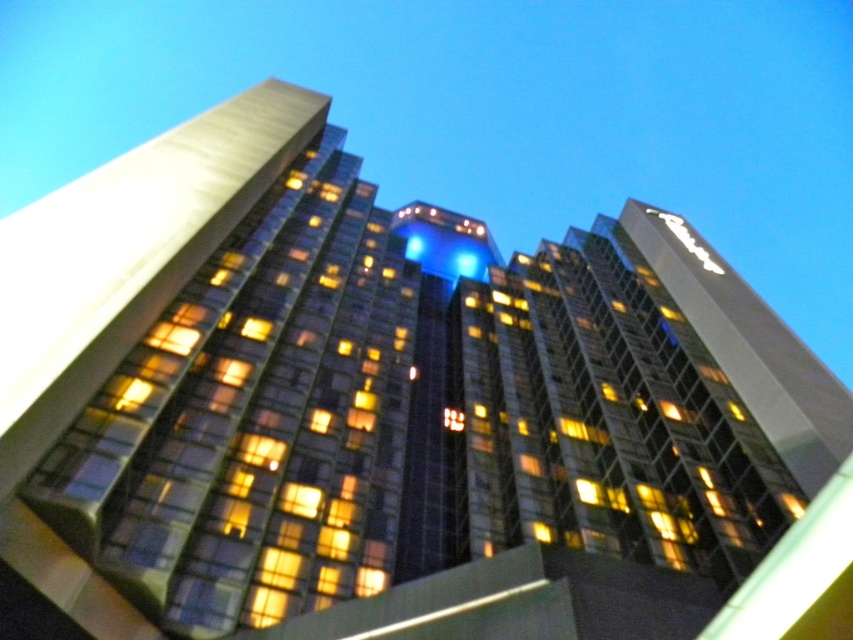
Question: Which object is farther from the camera taking this photo?

Choices:
 (A) white glossy sign at upper right
 (B) glassy reflective building at center

Answer: (A)

Question: Is glassy reflective building at center to the left of white glossy sign at upper right from the viewer's perspective?

Choices:
 (A) yes
 (B) no

Answer: (A)

Question: Is glassy reflective building at center to the left of white glossy sign at upper right from the viewer's perspective?

Choices:
 (A) yes
 (B) no

Answer: (A)

Question: Which point appears closest to the camera in this image?

Choices:
 (A) (292, 552)
 (B) (693, 243)

Answer: (A)

Question: Considering the relative positions of glassy reflective building at center and white glossy sign at upper right in the image provided, where is glassy reflective building at center located with respect to white glossy sign at upper right?

Choices:
 (A) above
 (B) below

Answer: (B)